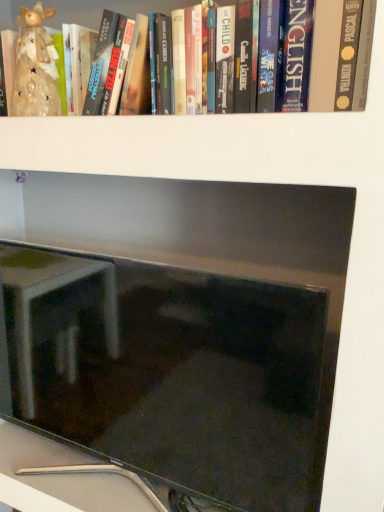
What do you see at coordinates (35, 67) in the screenshot?
I see `matte ceramic figurine at upper left` at bounding box center [35, 67].

Image resolution: width=384 pixels, height=512 pixels. I want to click on matte black monitor at center, so click(x=171, y=374).

This screenshot has width=384, height=512. I want to click on matte ceramic figurine at upper left, so click(35, 67).

Is matte ceramic figurine at upper left with matte black monitor at center?

There is a gap between matte ceramic figurine at upper left and matte black monitor at center.

Which of these two, matte ceramic figurine at upper left or matte black monitor at center, is smaller?

matte ceramic figurine at upper left is smaller.

Between matte ceramic figurine at upper left and matte black monitor at center, which one has less height?

Standing shorter between the two is matte ceramic figurine at upper left.

Is the position of matte ceramic figurine at upper left less distant than that of matte black monitor at center?

No, it is not.

Considering their positions, is matte ceramic figurine at upper left located in front of or behind hardcover book at upper center?

matte ceramic figurine at upper left is behind hardcover book at upper center.

Can you see matte ceramic figurine at upper left touching hardcover book at upper center?

matte ceramic figurine at upper left and hardcover book at upper center are clearly separated.

In the scene shown: In terms of width, does matte ceramic figurine at upper left look wider or thinner when compared to hardcover book at upper center?

matte ceramic figurine at upper left is thinner than hardcover book at upper center.

Between matte black monitor at center and matte ceramic figurine at upper left, which one has larger width?

matte black monitor at center.

From the image's perspective, is matte black monitor at center above or below matte ceramic figurine at upper left?

matte black monitor at center is situated lower than matte ceramic figurine at upper left in the image.

Is matte black monitor at center oriented away from matte ceramic figurine at upper left?

No, matte black monitor at center is not facing the opposite direction of matte ceramic figurine at upper left.

Identify the location of figurine above the matte black monitor at center (from the image's perspective). (35, 67).

You are a GUI agent. You are given a task and a screenshot of the screen. Output one action in this format:
    pyautogui.click(x=<x>, y=<y>)
    Task: Click on the computer monitor below the hardcover book at upper center (from the image's perspective)
    Image resolution: width=384 pixels, height=512 pixels.
    Given the screenshot: What is the action you would take?
    pyautogui.click(x=171, y=374)

Between point (338, 12) and point (42, 262), which one is positioned behind?

The point (42, 262) is behind.

Who is shorter, hardcover book at upper center or matte black monitor at center?

hardcover book at upper center is shorter.

Is hardcover book at upper center facing towards matte black monitor at center?

No, hardcover book at upper center is not aimed at matte black monitor at center.

Looking at the image, does matte black monitor at center seem bigger or smaller compared to hardcover book at upper center?

Considering their sizes, matte black monitor at center takes up more space than hardcover book at upper center.

Are matte black monitor at center and hardcover book at upper center making contact?

No, matte black monitor at center is not with hardcover book at upper center.

Is matte black monitor at center taller than hardcover book at upper center?

Yes.

Which is more to the right, matte black monitor at center or hardcover book at upper center?

From the viewer's perspective, hardcover book at upper center appears more on the right side.

Consider the image. From the image's perspective, is hardcover book at upper center above or below matte ceramic figurine at upper left?

From the image's perspective, hardcover book at upper center appears above matte ceramic figurine at upper left.

Between hardcover book at upper center and matte ceramic figurine at upper left, which one is positioned behind?

matte ceramic figurine at upper left is behind.

In the scene shown: Can you see hardcover book at upper center touching matte ceramic figurine at upper left?

hardcover book at upper center and matte ceramic figurine at upper left are clearly separated.

In terms of height, does hardcover book at upper center look taller or shorter compared to matte ceramic figurine at upper left?

In the image, hardcover book at upper center appears to be shorter than matte ceramic figurine at upper left.

At what (x,y) coordinates should I click in order to perform the action: click on figurine located above the matte black monitor at center (from the image's perspective). Please return your answer as a coordinate pair (x, y). Looking at the image, I should click on (35, 67).

The width and height of the screenshot is (384, 512). I want to click on figurine below the hardcover book at upper center (from the image's perspective), so click(x=35, y=67).

When comparing their distances from hardcover book at upper center, does matte ceramic figurine at upper left or matte black monitor at center seem further?

Based on the image, matte black monitor at center appears to be further to hardcover book at upper center.

Looking at the image, which one is located closer to matte black monitor at center, matte ceramic figurine at upper left or hardcover book at upper center?

The object closer to matte black monitor at center is matte ceramic figurine at upper left.

Based on their spatial positions, is hardcover book at upper center or matte ceramic figurine at upper left further from matte black monitor at center?

hardcover book at upper center is positioned further to the anchor matte black monitor at center.

When comparing their distances from matte ceramic figurine at upper left, does matte black monitor at center or hardcover book at upper center seem further?

Among the two, matte black monitor at center is located further to matte ceramic figurine at upper left.

Considering their positions, is hardcover book at upper center positioned further to matte ceramic figurine at upper left than matte black monitor at center?

Among the two, matte black monitor at center is located further to matte ceramic figurine at upper left.

From the image, which object appears to be farther from hardcover book at upper center, matte black monitor at center or matte ceramic figurine at upper left?

matte black monitor at center is positioned further to the anchor hardcover book at upper center.

The width and height of the screenshot is (384, 512). Find the location of `figurine between hardcover book at upper center and matte black monitor at center from top to bottom`. figurine between hardcover book at upper center and matte black monitor at center from top to bottom is located at coordinates (35, 67).